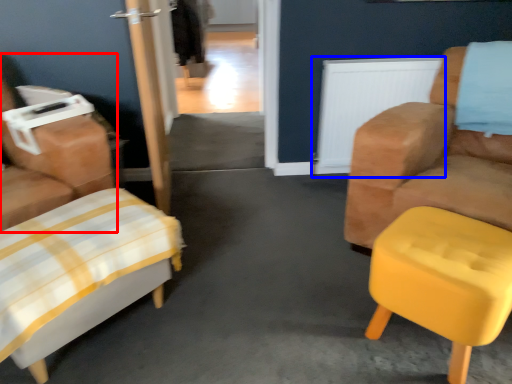
Question: Which object appears farthest to the camera in this image, chair (highlighted by a red box) or radiator (highlighted by a blue box)?

Choices:
 (A) chair
 (B) radiator

Answer: (B)